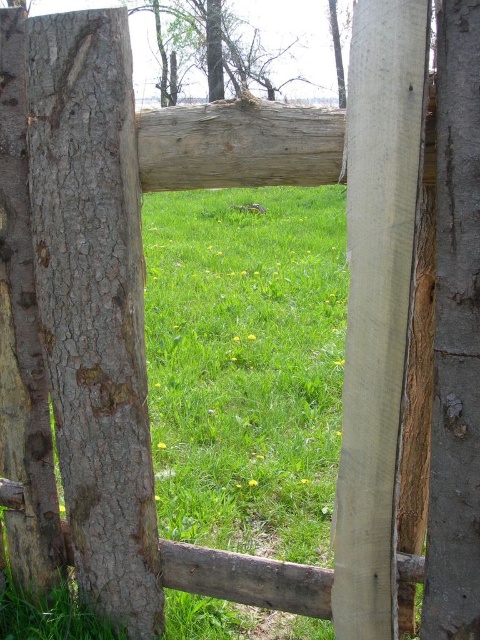
Question: Is gray rough bark tree trunk at left above smooth bark tree at upper center?

Choices:
 (A) no
 (B) yes

Answer: (A)

Question: Is gray rough bark tree trunk at left positioned in front of smooth bark tree at upper center?

Choices:
 (A) no
 (B) yes

Answer: (B)

Question: Which point appears closest to the camera in this image?

Choices:
 (A) coord(86,168)
 (B) coord(288,12)

Answer: (A)

Question: Which of the following is the farthest from the observer?

Choices:
 (A) (299, 13)
 (B) (90, 170)

Answer: (A)

Question: Can you confirm if gray rough bark tree trunk at left is positioned below smooth bark tree at upper center?

Choices:
 (A) yes
 (B) no

Answer: (A)